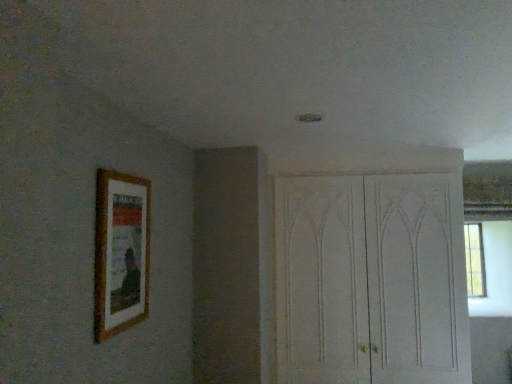
Question: Can you confirm if wooden picture frame at left is bigger than white wood dresser at right?

Choices:
 (A) no
 (B) yes

Answer: (A)

Question: From the image's perspective, is wooden picture frame at left over white wood dresser at right?

Choices:
 (A) yes
 (B) no

Answer: (A)

Question: Is wooden picture frame at left not within white wood dresser at right?

Choices:
 (A) yes
 (B) no

Answer: (A)

Question: Is wooden picture frame at left oriented away from white wood dresser at right?

Choices:
 (A) yes
 (B) no

Answer: (B)

Question: From a real-world perspective, does wooden picture frame at left sit lower than white wood dresser at right?

Choices:
 (A) no
 (B) yes

Answer: (A)

Question: Is wooden picture frame at left at the left side of white wood dresser at right?

Choices:
 (A) yes
 (B) no

Answer: (A)

Question: Does white wood dresser at right have a lesser width compared to wooden picture frame at left?

Choices:
 (A) yes
 (B) no

Answer: (B)

Question: Is white wood dresser at right far from wooden picture frame at left?

Choices:
 (A) yes
 (B) no

Answer: (A)

Question: Can you confirm if white wood dresser at right is bigger than wooden picture frame at left?

Choices:
 (A) no
 (B) yes

Answer: (B)

Question: Is white wood dresser at right behind wooden picture frame at left?

Choices:
 (A) no
 (B) yes

Answer: (B)

Question: Does white wood dresser at right have a greater width compared to wooden picture frame at left?

Choices:
 (A) yes
 (B) no

Answer: (A)

Question: From the image's perspective, is white wood dresser at right located beneath wooden picture frame at left?

Choices:
 (A) yes
 (B) no

Answer: (A)

Question: Is white wood dresser at right wider or thinner than wooden picture frame at left?

Choices:
 (A) wide
 (B) thin

Answer: (A)